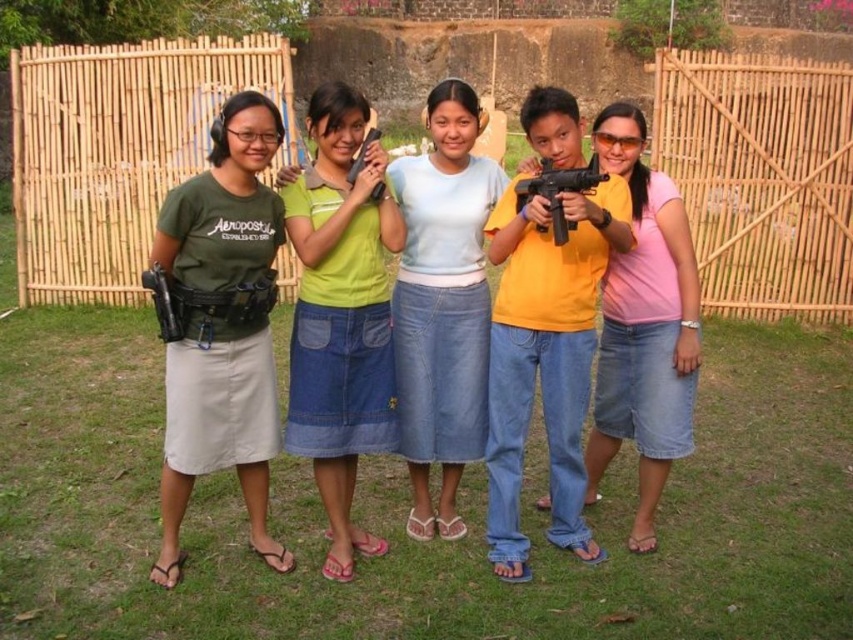
Is green matte t-shirt at left to the right of green denim skirt at center from the viewer's perspective?

Incorrect, green matte t-shirt at left is not on the right side of green denim skirt at center.

Does green matte t-shirt at left have a lesser width compared to green denim skirt at center?

No, green matte t-shirt at left is not thinner than green denim skirt at center.

I want to click on green matte t-shirt at left, so click(x=222, y=326).

Where is `green matte t-shirt at left`? The width and height of the screenshot is (853, 640). green matte t-shirt at left is located at coordinates (222, 326).

At what (x,y) coordinates should I click in order to perform the action: click on green matte t-shirt at left. Please return your answer as a coordinate pair (x, y). Image resolution: width=853 pixels, height=640 pixels. Looking at the image, I should click on pyautogui.click(x=222, y=326).

Between point (234, 278) and point (177, 291), which one is positioned behind?

The point (234, 278) is more distant.

Which is behind, point (274, 440) or point (175, 300)?

Positioned behind is point (274, 440).

The width and height of the screenshot is (853, 640). I want to click on green matte t-shirt at left, so click(222, 326).

Which of these two, green denim skirt at center or matte black gun at left, stands shorter?

matte black gun at left

Does point (350, 465) come farther from viewer compared to point (161, 292)?

Yes, point (350, 465) is farther from viewer.

At what (x,y) coordinates should I click in order to perform the action: click on green denim skirt at center. Please return your answer as a coordinate pair (x, y). This screenshot has height=640, width=853. Looking at the image, I should click on (340, 314).